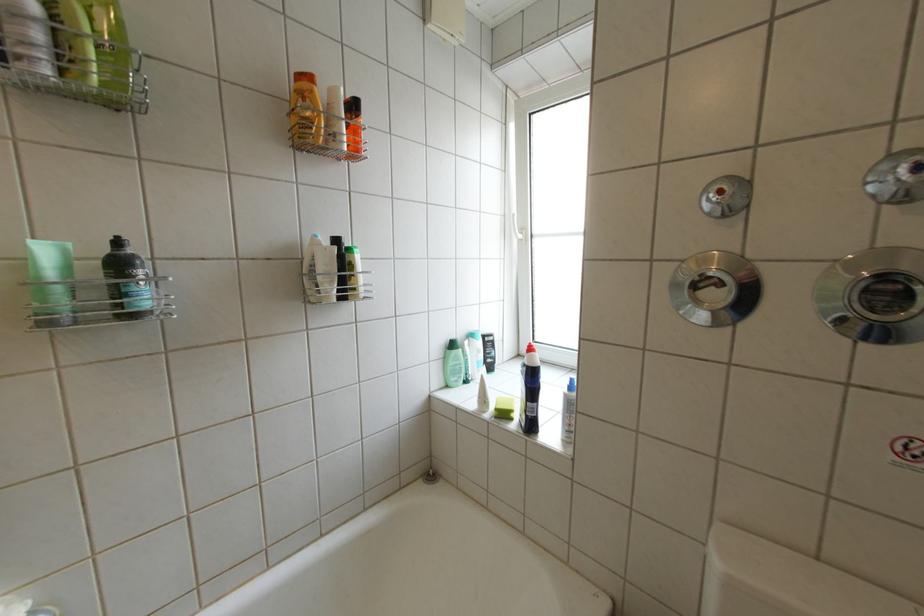
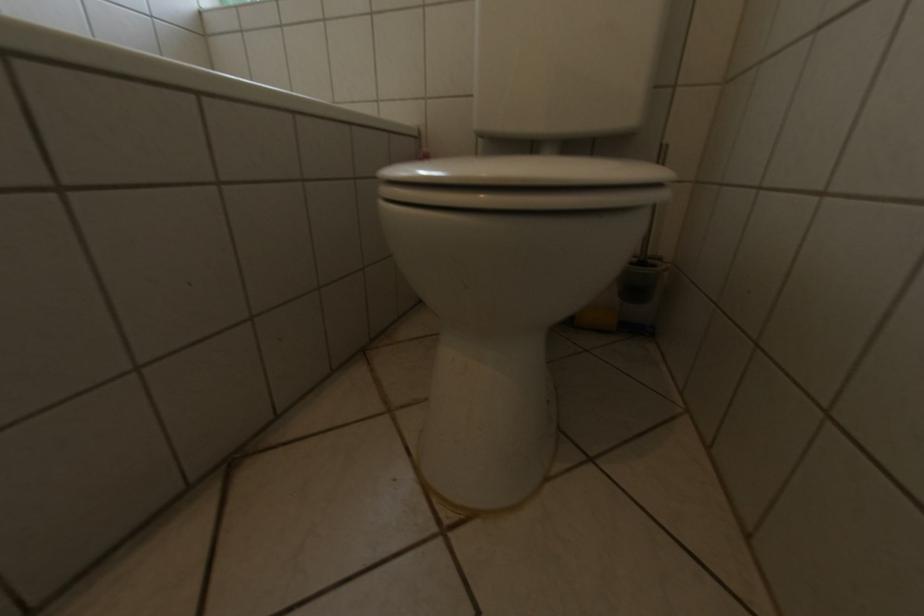
Which direction would the cameraman need to move to produce the second image?

The cameraman moved toward right, backward.